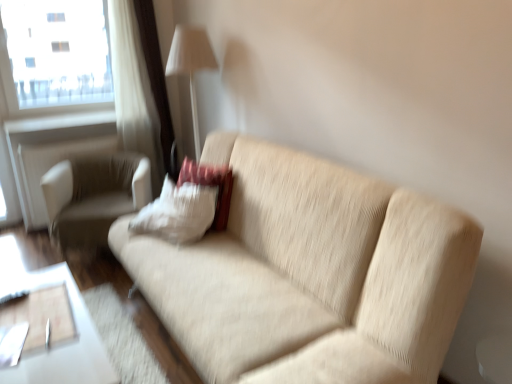
The image size is (512, 384). In order to click on transparent glass window at upper left in this screenshot , I will do tap(55, 56).

Find the location of a particular element. The width and height of the screenshot is (512, 384). beige fabric couch at center is located at coordinates (310, 275).

What do you see at coordinates (191, 65) in the screenshot?
I see `white fabric lampshade at upper center` at bounding box center [191, 65].

Locate an element on the screen. white fabric lampshade at upper center is located at coordinates (191, 65).

The width and height of the screenshot is (512, 384). What do you see at coordinates (100, 114) in the screenshot? I see `white fabric window frame at upper left` at bounding box center [100, 114].

At what (x,y) coordinates should I click in order to perform the action: click on white fabric window frame at upper left. Please return your answer as a coordinate pair (x, y). The height and width of the screenshot is (384, 512). Looking at the image, I should click on (100, 114).

You are a GUI agent. You are given a task and a screenshot of the screen. Output one action in this format:
    pyautogui.click(x=<x>, y=<y>)
    Task: Click on the transparent glass window at upper left
    The image size is (512, 384).
    Given the screenshot: What is the action you would take?
    pyautogui.click(x=55, y=56)

Looking at this image, does beige fabric couch at center turn towards white fabric chair at left?

No, beige fabric couch at center is not oriented towards white fabric chair at left.

Would you say beige fabric couch at center is outside white fabric chair at left?

Indeed, beige fabric couch at center is completely outside white fabric chair at left.

Considering the relative sizes of beige fabric couch at center and white fabric chair at left in the image provided, is beige fabric couch at center wider than white fabric chair at left?

Yes.

From a real-world perspective, is transparent glass window at upper left located beneath white fabric window frame at upper left?

No, from a real-world perspective, transparent glass window at upper left is not beneath white fabric window frame at upper left.

Which point is more distant from viewer, [48,10] or [156,149]?

The point [48,10] is farther from the camera.

From the picture: How different are the orientations of transparent glass window at upper left and white fabric window frame at upper left in degrees?

The angular difference between transparent glass window at upper left and white fabric window frame at upper left is 1.16 degrees.

Identify the location of window frame lying on the right of transparent glass window at upper left. (100, 114).

Consider the image. Considering the positions of objects white soft pillow at center and white glossy table at lower left in the image provided, who is behind, white soft pillow at center or white glossy table at lower left?

white soft pillow at center is further from the camera.

Looking at this image, how many degrees apart are the facing directions of white soft pillow at center and white glossy table at lower left?

They differ by 91.3 degrees in their facing directions.

Does white soft pillow at center turn towards white glossy table at lower left?

No, white soft pillow at center is not facing towards white glossy table at lower left.

Is white soft pillow at center positioned far away from white glossy table at lower left?

They are positioned close to each other.

Is white glossy table at lower left to the right of white fabric chair at left from the viewer's perspective?

Correct, you'll find white glossy table at lower left to the right of white fabric chair at left.

In terms of width, does white glossy table at lower left look wider or thinner when compared to white fabric chair at left?

In the image, white glossy table at lower left appears to be wider than white fabric chair at left.

I want to click on table below the white fabric chair at left (from the image's perspective), so click(64, 342).

Where is `window frame that is above the white soft pillow at center (from a real-world perspective)`? The image size is (512, 384). window frame that is above the white soft pillow at center (from a real-world perspective) is located at coordinates (100, 114).

Is white fabric window frame at upper left completely or partially inside white soft pillow at center?

No, white soft pillow at center does not contain white fabric window frame at upper left.

How different are the orientations of white soft pillow at center and white fabric window frame at upper left in degrees?

91.4 degrees.

Considering their positions, is white soft pillow at center located in front of or behind white fabric window frame at upper left?

Visually, white soft pillow at center is located in front of white fabric window frame at upper left.

Is beige fabric couch at center surrounded by transparent glass window at upper left?

No.

Looking at the image, does transparent glass window at upper left seem bigger or smaller compared to beige fabric couch at center?

In the image, transparent glass window at upper left appears to be smaller than beige fabric couch at center.

From the image's perspective, between transparent glass window at upper left and beige fabric couch at center, who is located below?

beige fabric couch at center.

Are transparent glass window at upper left and white matte radiator at upper left far apart?

They are positioned close to each other.

How far apart are transparent glass window at upper left and white matte radiator at upper left?

A distance of 21.39 inches exists between transparent glass window at upper left and white matte radiator at upper left.

Is white matte radiator at upper left located within transparent glass window at upper left?

No, transparent glass window at upper left does not contain white matte radiator at upper left.

Is transparent glass window at upper left oriented away from white matte radiator at upper left?

No.

Locate an element on the screen. Image resolution: width=512 pixels, height=384 pixels. studio couch in front of the white fabric chair at left is located at coordinates (310, 275).

At what (x,y) coordinates should I click in order to perform the action: click on window frame lying on the right of transparent glass window at upper left. Please return your answer as a coordinate pair (x, y). Looking at the image, I should click on (100, 114).

Considering their positions, is white fabric window frame at upper left positioned closer to white matte radiator at upper left than white fabric lampshade at upper center?

white fabric window frame at upper left lies closer to white matte radiator at upper left than the other object.

Which object lies further to the anchor point white fabric chair at left, white fabric lampshade at upper center or beige fabric couch at center?

beige fabric couch at center.

Based on their spatial positions, is white fabric lampshade at upper center or white soft pillow at center closer to beige fabric couch at center?

white soft pillow at center.

Estimate the real-world distances between objects in this image. Which object is closer to white matte radiator at upper left, white glossy table at lower left or beige fabric couch at center?

The object closer to white matte radiator at upper left is white glossy table at lower left.

From the image, which object appears to be farther from white fabric lampshade at upper center, white fabric window frame at upper left or beige fabric couch at center?

beige fabric couch at center is further to white fabric lampshade at upper center.

Which object lies further to the anchor point white fabric lampshade at upper center, white soft pillow at center or beige fabric couch at center?

The object further to white fabric lampshade at upper center is beige fabric couch at center.

Which object lies further to the anchor point white fabric chair at left, beige fabric couch at center or white glossy table at lower left?

The object further to white fabric chair at left is beige fabric couch at center.

Based on their spatial positions, is transparent glass window at upper left or beige fabric couch at center further from white matte radiator at upper left?

beige fabric couch at center.

The width and height of the screenshot is (512, 384). I want to click on window frame between transparent glass window at upper left and white fabric lampshade at upper center, so click(100, 114).

The width and height of the screenshot is (512, 384). In order to click on table lamp situated between white fabric window frame at upper left and white soft pillow at center from left to right in this screenshot , I will do `click(191, 65)`.

Identify the location of window frame positioned between beige fabric couch at center and white fabric chair at left from near to far. (100, 114).

This screenshot has width=512, height=384. In order to click on table lamp between beige fabric couch at center and white matte radiator at upper left in the front-back direction in this screenshot , I will do `click(191, 65)`.